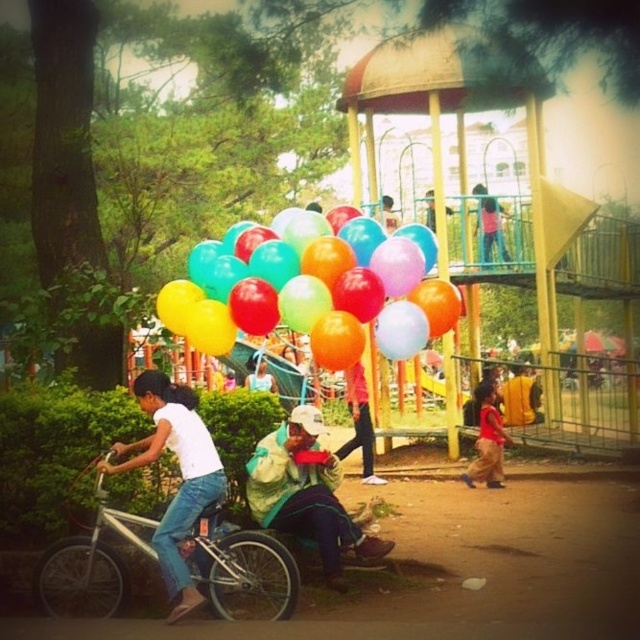
You are standing at the playground and want to buy a balloon from the vendor holding the balloons at point (300,288). If you start walking straight from your current position at point 0.300, 0.300, will you reach the balloons before reaching the playground structure at point 0.600, 0.600?

The balloons are located at point (300,288). Your starting point is 0.300, 0.300, and the playground structure is at 0.600, 0.600. Calculating the distances, the distance to the balloons is shorter than the distance to the playground structure. Therefore, you will reach the balloons before the playground structure.

You are a photographer trying to capture the multicolored balloons at center and the red cotton shirt at lower right in a single shot. Based on their positions, which object should you focus on first to ensure both are in frame?

The multicolored balloons at center are above the red cotton shirt at lower right, so you should focus on the red cotton shirt at lower right first to ensure both are in frame.

You are standing at the playground and want to take a photo of both the point at coordinates point (214, 291) and point (60, 579). Which point should you focus on first to ensure both are in focus?

You should focus on point (214, 291) first because it is closer to the camera than point (60, 579). This ensures both points are within the depth of field.